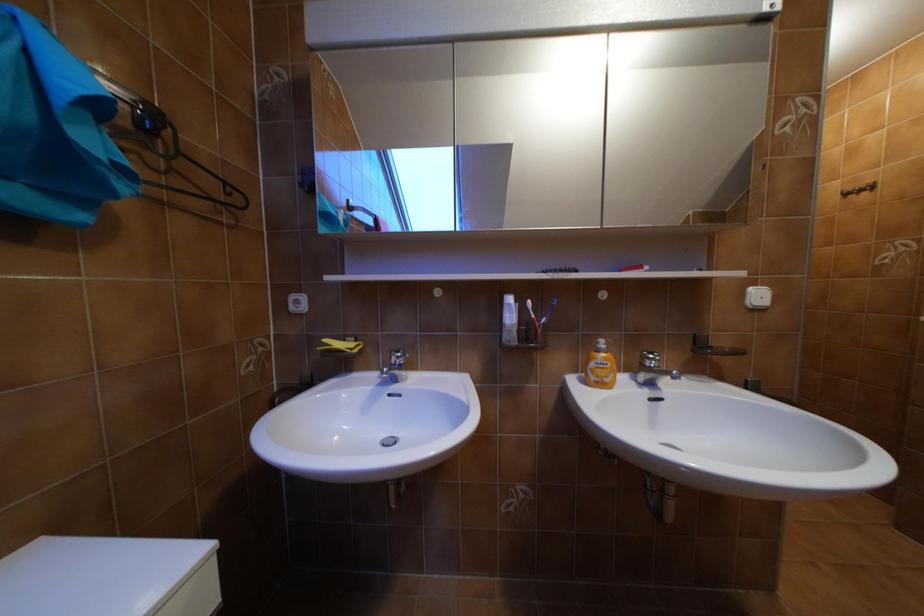
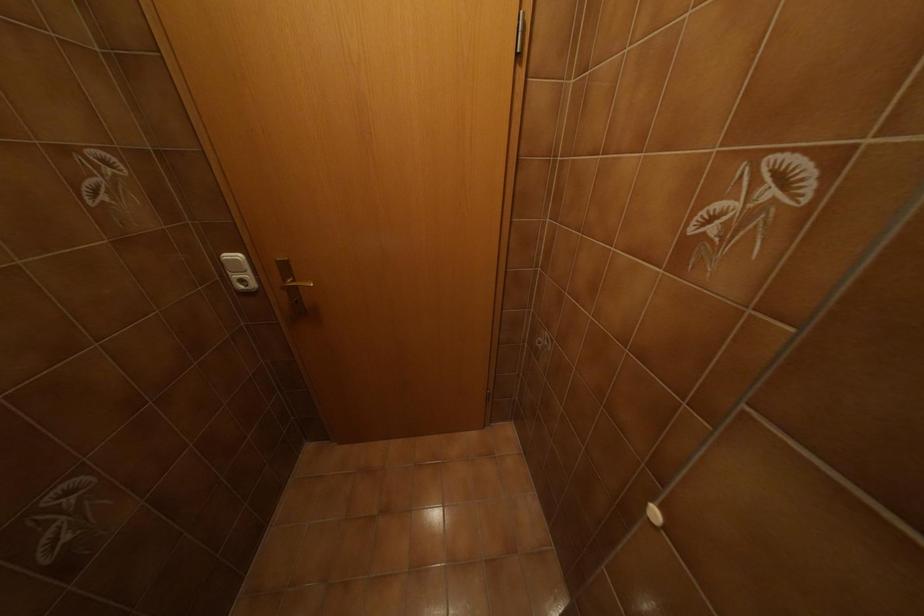
Which direction would the cameraman need to move to produce the second image?

The movement direction of the cameraman is right, forward.